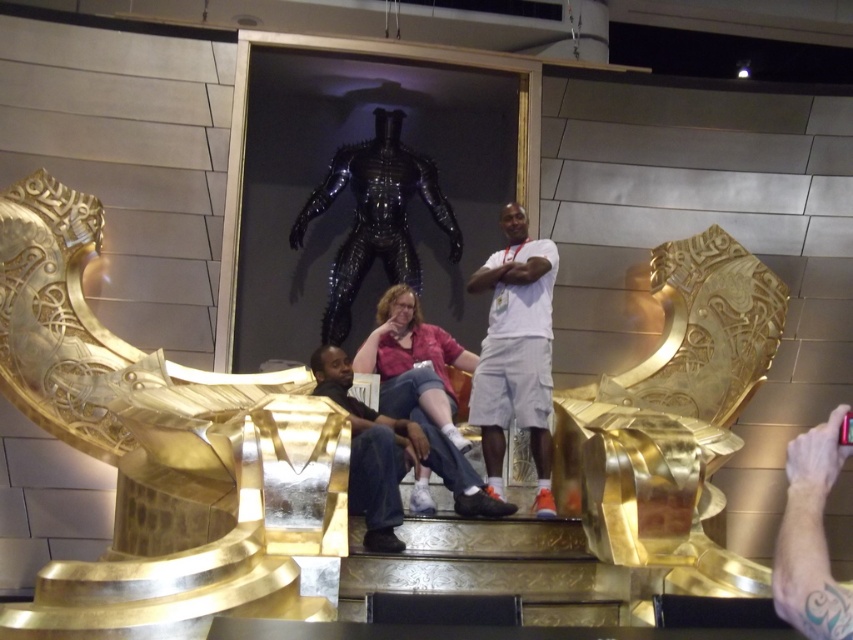
Question: Is white matte shorts at center wider than black glossy alien at center?

Choices:
 (A) yes
 (B) no

Answer: (B)

Question: Is white matte shorts at center thinner than matte black pants at center?

Choices:
 (A) yes
 (B) no

Answer: (A)

Question: Which of the following is the closest to the observer?

Choices:
 (A) pyautogui.click(x=380, y=364)
 (B) pyautogui.click(x=392, y=211)
 (C) pyautogui.click(x=112, y=356)
 (D) pyautogui.click(x=393, y=461)

Answer: (D)

Question: Is the position of black glossy alien at center more distant than that of matte pink shirt at center?

Choices:
 (A) yes
 (B) no

Answer: (A)

Question: Which object is closer to the camera taking this photo?

Choices:
 (A) matte pink shirt at center
 (B) gold polished metal throne at center
 (C) white matte shorts at center

Answer: (B)

Question: Which point appears closest to the camera in this image?

Choices:
 (A) (412, 410)
 (B) (496, 458)

Answer: (B)